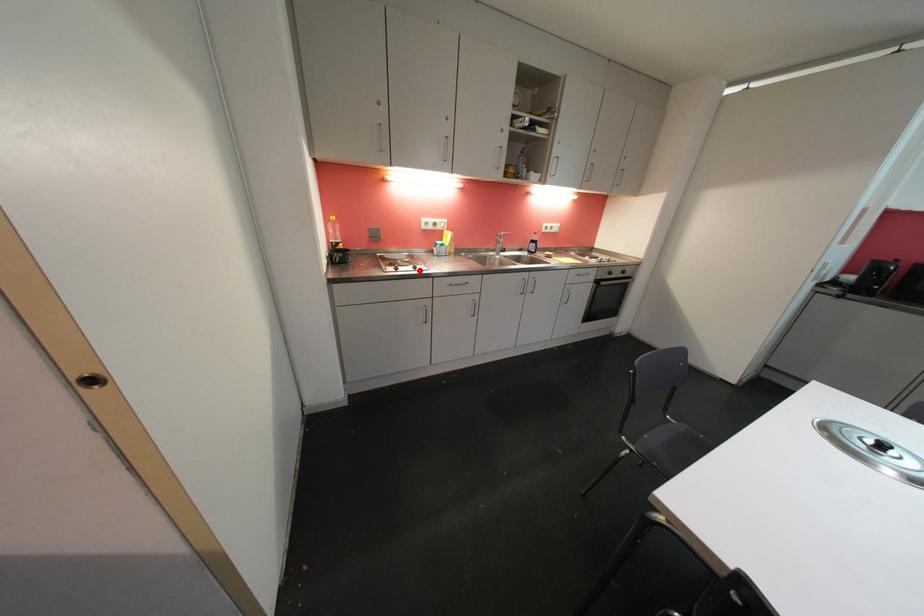
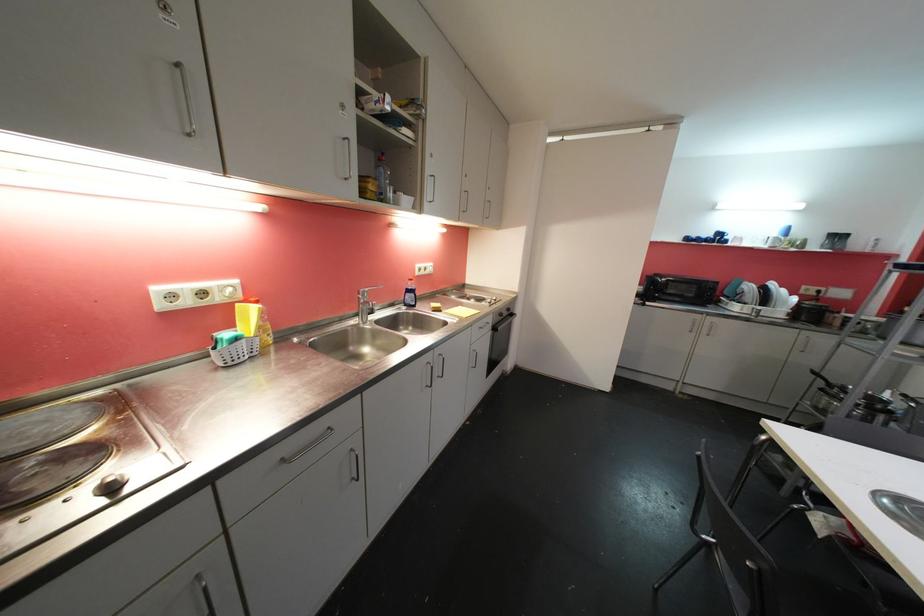
Where in the second image is the point corresponding to the highlighted location from the first image?

(116, 490)